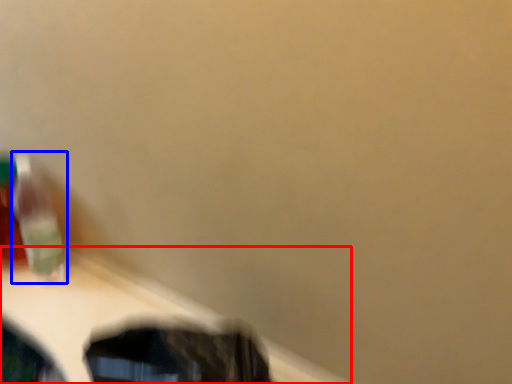
Question: Which object appears closest to the camera in this image, table (highlighted by a red box) or toothbrush (highlighted by a blue box)?

Choices:
 (A) table
 (B) toothbrush

Answer: (A)